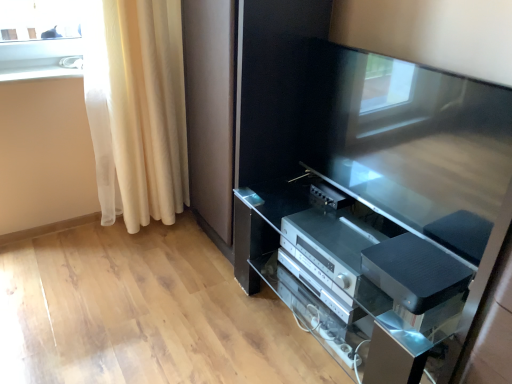
Locate an element on the screen. Image resolution: width=512 pixels, height=384 pixels. free area below satin black tv cabinet at center (from a real-world perspective) is located at coordinates coord(303,327).